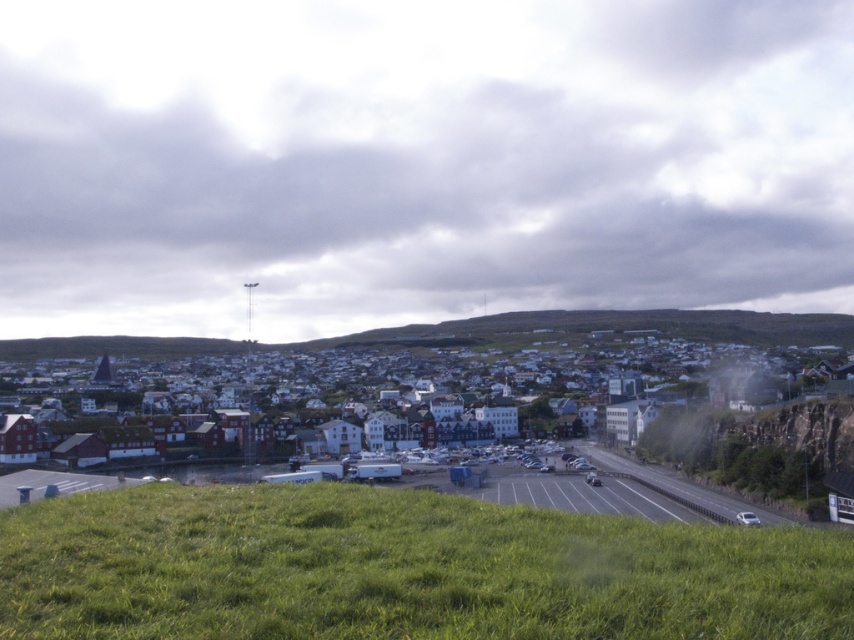
You are standing on the edge of the green grassy field at lower center and want to walk towards the white matte buildings at center. Which direction should you head to reach them?

You should head upwards because the green grassy field at lower center is narrower than the white matte buildings at center, which are wider and located higher up in the scene.

Consider the image. You are standing on the road leading to the town and see the green grassy field at lower center and the white matte buildings at center. Which object is located to the left when facing towards the town?

The green grassy field at lower center is to the left of the white matte buildings at center when facing towards the town.

You are standing at the point marked as point (401,570) in the image. Looking around, what do you see immediately in front of you?

You are standing at the green grassy field at lower center, so immediately in front of you would be the grassy area itself. Since the scene shows a grassy hill sloping downward towards the town, the terrain ahead likely continues the gentle slope towards the town and the road beyond.